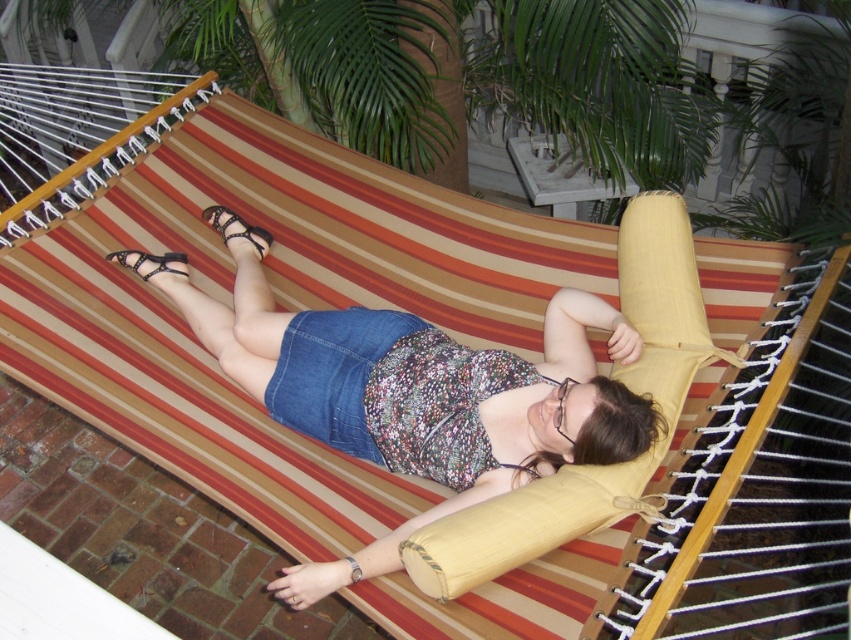
Question: Which object is the closest to the black leather sandal at center?

Choices:
 (A) denim skirt at center
 (B) black leather sandal at lower left

Answer: (B)

Question: Is black leather sandal at center bigger than black leather sandal at lower left?

Choices:
 (A) no
 (B) yes

Answer: (B)

Question: Which object appears closest to the camera in this image?

Choices:
 (A) black leather sandal at center
 (B) denim skirt at center
 (C) black leather sandal at lower left

Answer: (B)

Question: Can you confirm if denim skirt at center is bigger than black leather sandal at center?

Choices:
 (A) no
 (B) yes

Answer: (B)

Question: Is denim skirt at center wider than black leather sandal at center?

Choices:
 (A) yes
 (B) no

Answer: (A)

Question: Estimate the real-world distances between objects in this image. Which object is farther from the black leather sandal at center?

Choices:
 (A) black leather sandal at lower left
 (B) denim skirt at center

Answer: (B)